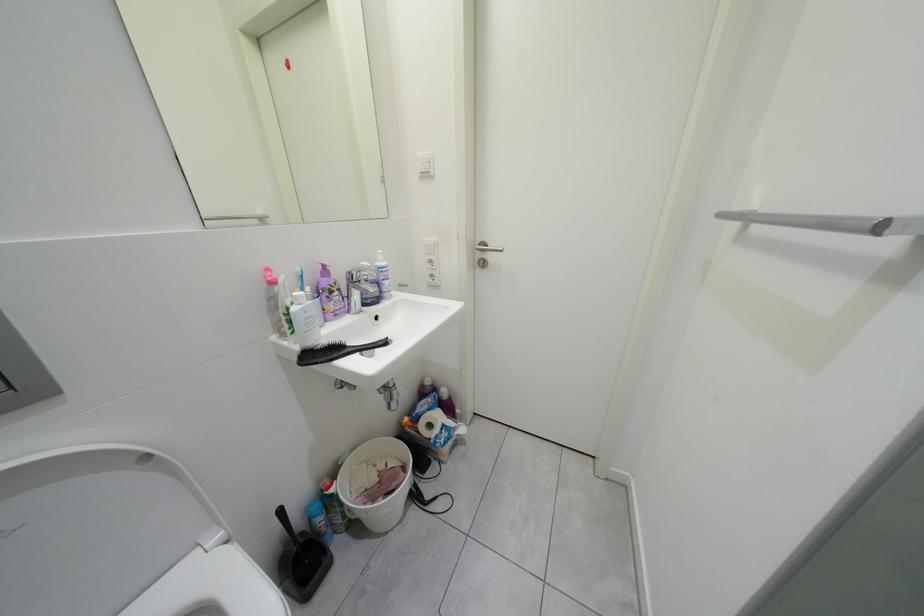
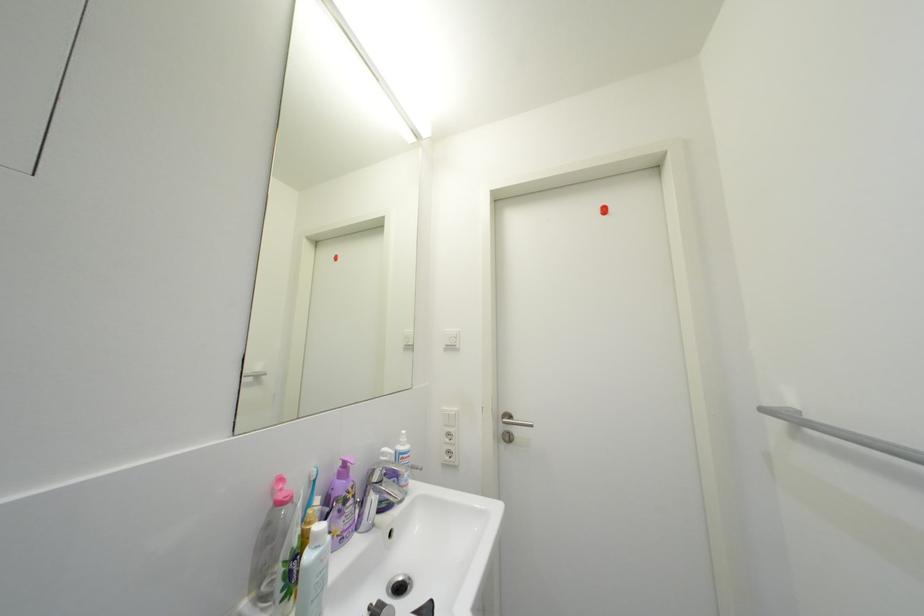
Question: The first image is from the beginning of the video and the second image is from the end. How did the camera likely rotate when shooting the video?

Choices:
 (A) Left
 (B) Right
 (C) Up
 (D) Down

Answer: (C)